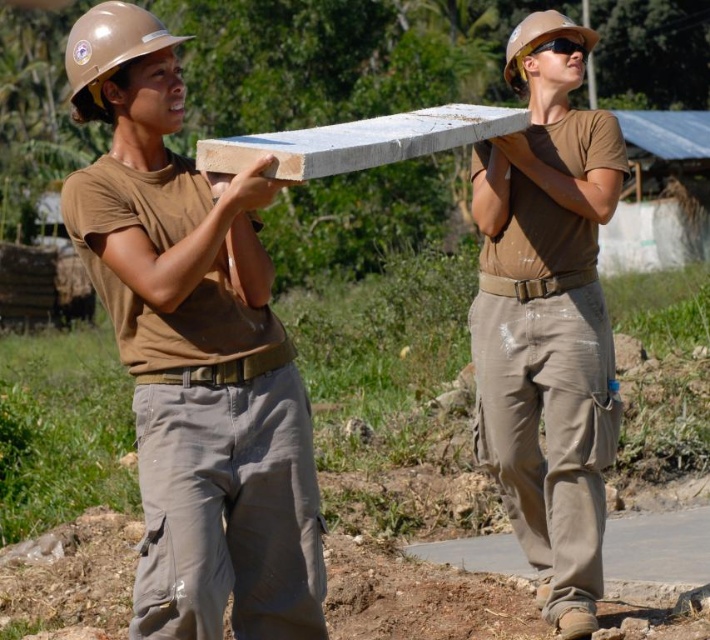
The height and width of the screenshot is (640, 710). Describe the element at coordinates (109, 52) in the screenshot. I see `matte brown hard hat at upper left` at that location.

Can you confirm if matte brown hard hat at upper left is thinner than matte brown hard hat at upper center?

In fact, matte brown hard hat at upper left might be wider than matte brown hard hat at upper center.

Where is `matte brown hard hat at upper left`? matte brown hard hat at upper left is located at coordinates (109, 52).

Find the location of `matte brown hard hat at upper left`. matte brown hard hat at upper left is located at coordinates (109, 52).

Between matte concrete plank at center and matte brown hard hat at upper center, which one is positioned higher?

matte brown hard hat at upper center

Is point (535, 122) closer to camera compared to point (573, 32)?

That is False.

Which is behind, point (577, 515) or point (523, 84)?

Point (523, 84)

This screenshot has height=640, width=710. In order to click on matte concrete plank at center in this screenshot , I will do `click(547, 317)`.

From the picture: Does matte concrete block at upper center have a lesser height compared to matte concrete plank at center?

Indeed, matte concrete block at upper center has a lesser height compared to matte concrete plank at center.

Is matte concrete block at upper center further to the viewer compared to matte concrete plank at center?

No, matte concrete block at upper center is in front of matte concrete plank at center.

This screenshot has height=640, width=710. Describe the element at coordinates (192, 353) in the screenshot. I see `matte concrete block at upper center` at that location.

At what (x,y) coordinates should I click in order to perform the action: click on matte concrete block at upper center. Please return your answer as a coordinate pair (x, y). Looking at the image, I should click on (192, 353).